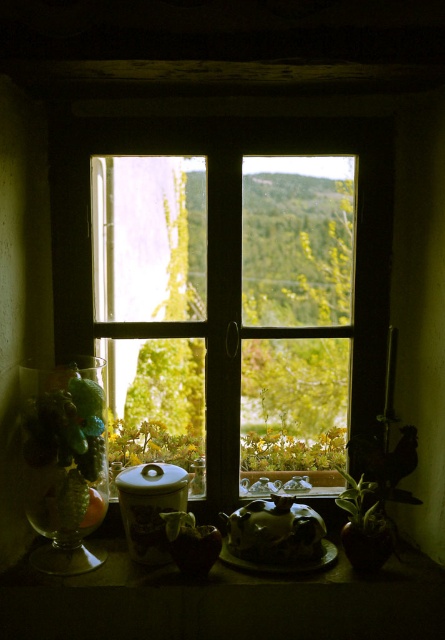
Question: Which point appears closest to the camera in this image?

Choices:
 (A) (354, 214)
 (B) (284, 536)

Answer: (B)

Question: Can you confirm if wooden window at center is smaller than matte ceramic teapot at center?

Choices:
 (A) yes
 (B) no

Answer: (B)

Question: Observing the image, what is the correct spatial positioning of wooden window at center in reference to matte ceramic teapot at center?

Choices:
 (A) right
 (B) left

Answer: (B)

Question: Can you confirm if wooden window at center is wider than matte ceramic teapot at center?

Choices:
 (A) no
 (B) yes

Answer: (B)